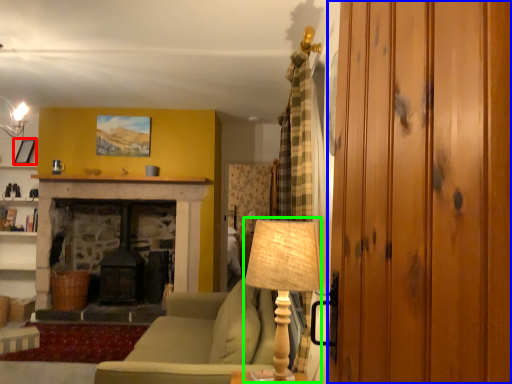
Question: Based on their relative distances, which object is farther from picture frame (highlighted by a red box)? Choose from glass door (highlighted by a blue box) and table lamp (highlighted by a green box).

Choices:
 (A) glass door
 (B) table lamp

Answer: (A)